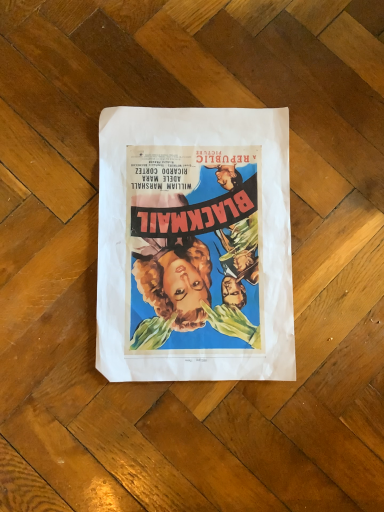
Describe the element at coordinates (194, 245) in the screenshot. I see `matte paper poster at center` at that location.

Image resolution: width=384 pixels, height=512 pixels. I want to click on matte paper poster at center, so pyautogui.click(x=194, y=245).

I want to click on matte paper poster at center, so click(x=194, y=245).